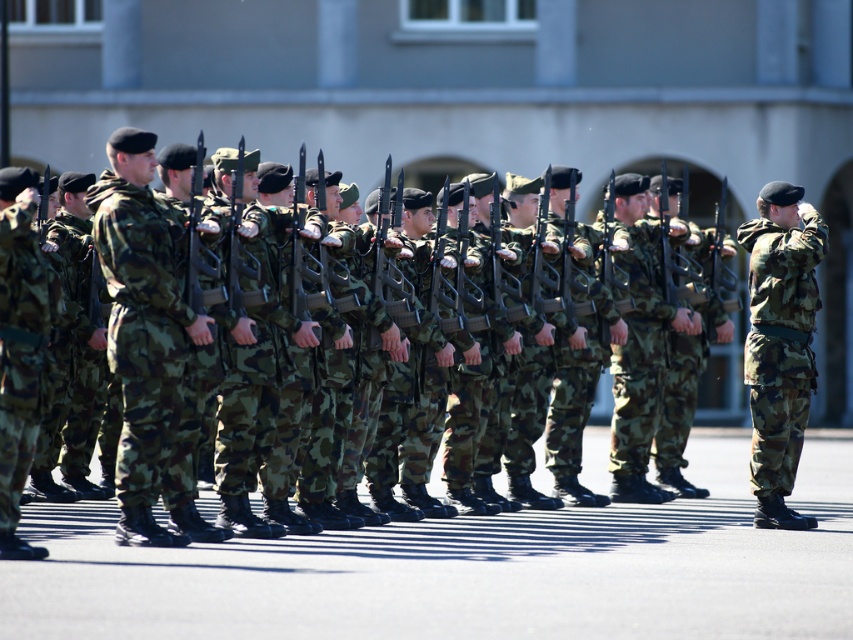
You are a photographer standing at the parade ground and want to capture a close shot of the point at coordinates point (187, 310). Considering your camera has a maximum focus range of 25 meters, can you focus on that point?

The point (187, 310) is 26.69 meters away from the viewer, which exceeds the camera maximum focus range of 25 meters. Therefore, the camera cannot focus on that point.

You are a photographer positioned at the origin point of the scene. You want to capture the camouflage fabric uniform at center in your shot. What are the coordinates where you should aim your camera?

The camouflage fabric uniform at center is located at coordinates point (142, 326), so you should aim your camera at those coordinates to capture it.

You are a photographer taking a picture of the military parade. You notice two soldiers in the foreground. One is wearing a camouflage fabric uniform at left and the other has camo fabric pants at center. Which soldier is positioned closer to the camera?

The camouflage fabric uniform at left is closer to the viewer than the camo fabric pants at center, so the soldier in the camouflage fabric uniform at left is positioned closer to the camera.